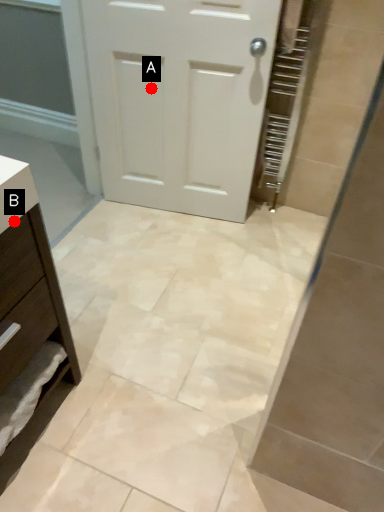
Question: Two points are circled on the image, labeled by A and B beside each circle. Which point is closer to the camera?

Choices:
 (A) A is closer
 (B) B is closer

Answer: (B)